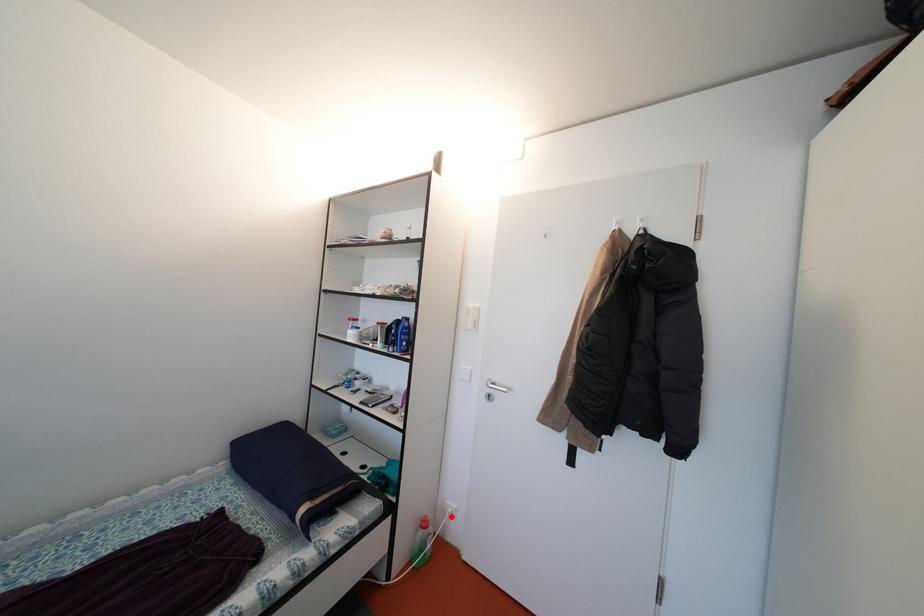
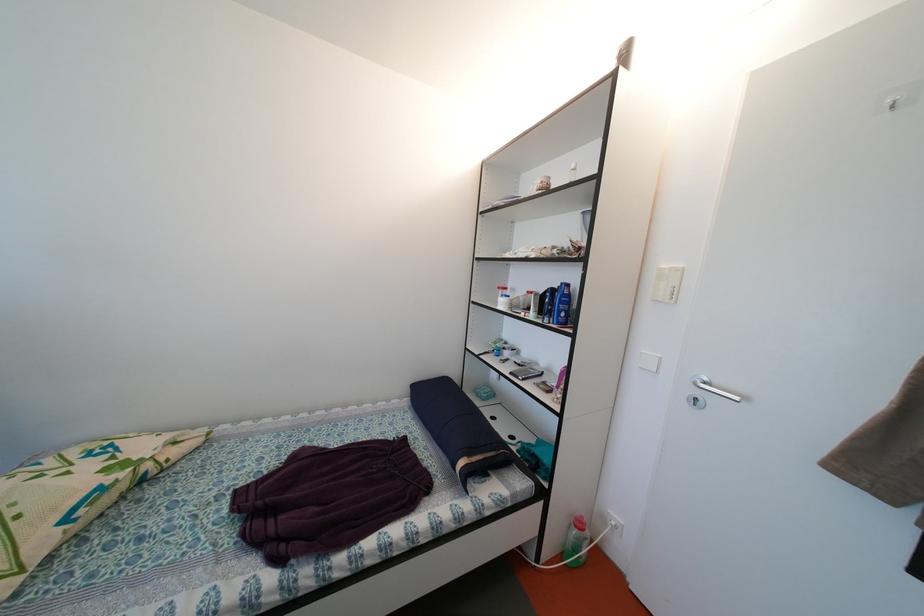
Find the pixel in the second image that matches the highlighted location in the first image.

(611, 525)